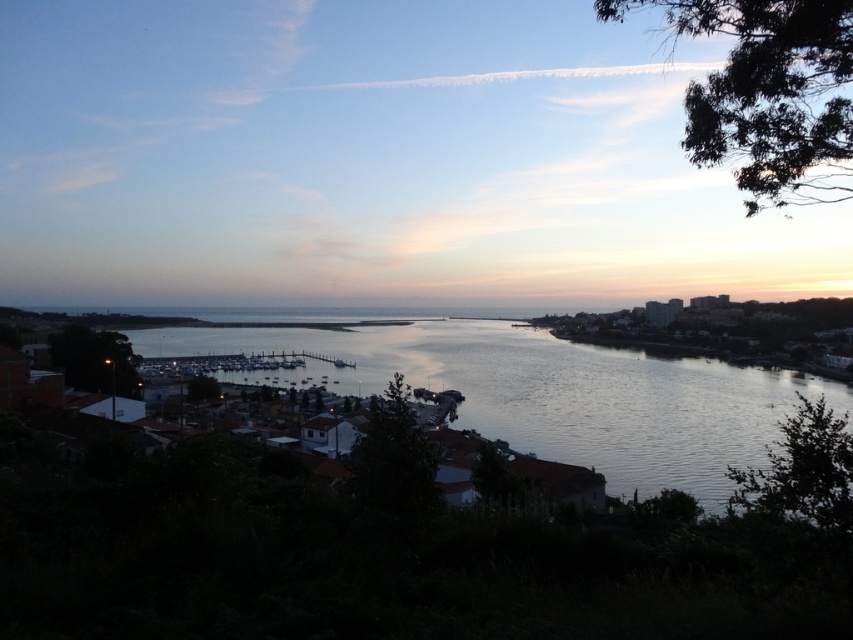
Does pastel sky at center appear over silvery water at center?

Correct, pastel sky at center is located above silvery water at center.

In order to click on pastel sky at center in this screenshot , I will do `click(370, 160)`.

Locate an element on the screen. The height and width of the screenshot is (640, 853). pastel sky at center is located at coordinates (370, 160).